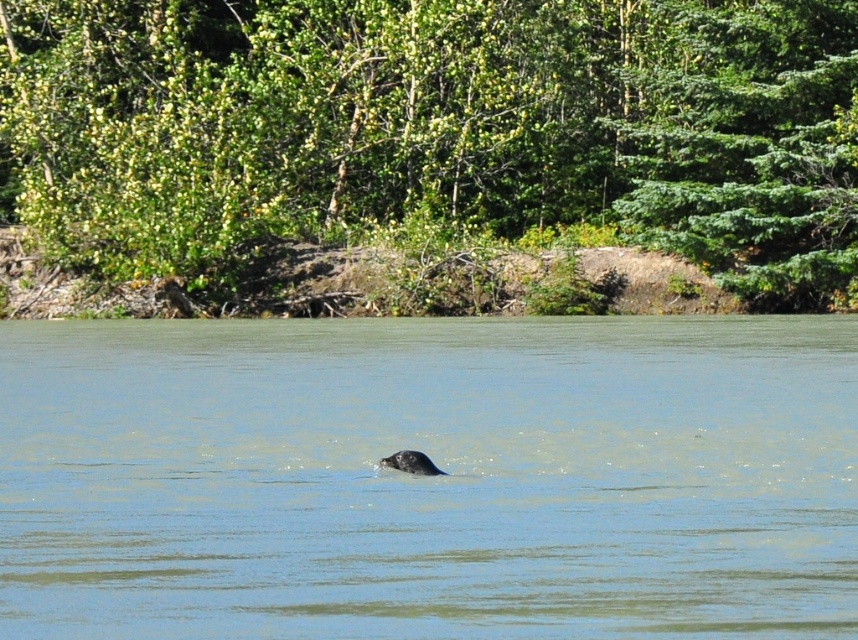
Does point (849, 480) come in front of point (696, 170)?

Yes, point (849, 480) is closer to viewer.

Identify the location of clear water at center. The image size is (858, 640). (429, 477).

Does point (236, 561) come in front of point (427, 474)?

Yes.

Between point (508, 474) and point (426, 472), which one is positioned behind?

Point (508, 474)

Is point (568, 528) less distant than point (426, 458)?

Yes, point (568, 528) is in front of point (426, 458).

This screenshot has height=640, width=858. In order to click on clear water at center in this screenshot , I will do `click(429, 477)`.

Which is in front, point (657, 70) or point (414, 456)?

Point (414, 456) is in front.

Which of these two, green leafy tree at upper right or gray fur seal at center, stands taller?

green leafy tree at upper right

Does point (826, 88) come behind point (408, 460)?

That is True.

Find the location of a particular element. green leafy tree at upper right is located at coordinates (754, 152).